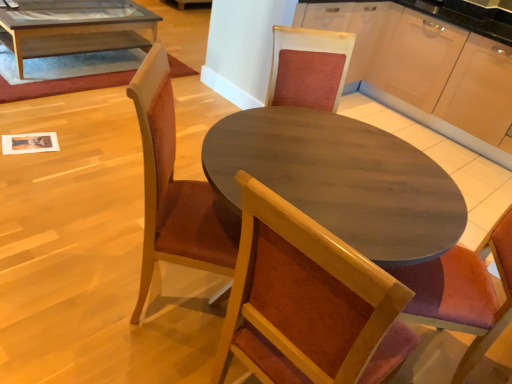
Question: Is clear glass coffee table at upper left outside of wooden chair at center?

Choices:
 (A) no
 (B) yes

Answer: (B)

Question: Is wooden chair at center at the back of clear glass coffee table at upper left?

Choices:
 (A) yes
 (B) no

Answer: (B)

Question: From the image's perspective, is clear glass coffee table at upper left located above wooden chair at center?

Choices:
 (A) no
 (B) yes

Answer: (B)

Question: Is clear glass coffee table at upper left taller than wooden chair at center?

Choices:
 (A) no
 (B) yes

Answer: (A)

Question: Can you confirm if clear glass coffee table at upper left is smaller than wooden chair at center?

Choices:
 (A) yes
 (B) no

Answer: (B)

Question: Does clear glass coffee table at upper left touch wooden chair at center?

Choices:
 (A) no
 (B) yes

Answer: (A)

Question: From a real-world perspective, is wooden chair at center physically below clear glass coffee table at upper left?

Choices:
 (A) no
 (B) yes

Answer: (A)

Question: Can you confirm if wooden chair at center is smaller than clear glass coffee table at upper left?

Choices:
 (A) no
 (B) yes

Answer: (B)

Question: Is wooden chair at center thinner than clear glass coffee table at upper left?

Choices:
 (A) no
 (B) yes

Answer: (B)

Question: From the image's perspective, is wooden chair at center beneath clear glass coffee table at upper left?

Choices:
 (A) no
 (B) yes

Answer: (B)

Question: Is wooden chair at center surrounding clear glass coffee table at upper left?

Choices:
 (A) no
 (B) yes

Answer: (A)

Question: Can you confirm if wooden chair at center is positioned to the left of clear glass coffee table at upper left?

Choices:
 (A) yes
 (B) no

Answer: (B)

Question: Is wooden chair at center in front of or behind clear glass coffee table at upper left in the image?

Choices:
 (A) behind
 (B) front

Answer: (B)